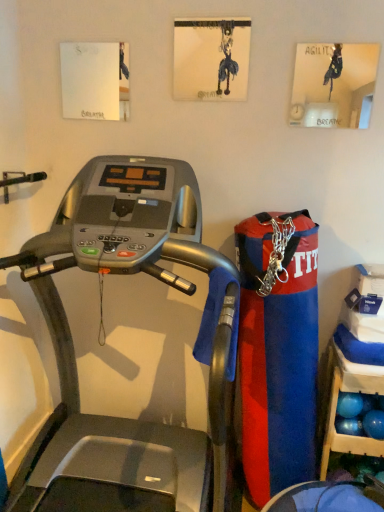
Question: Does silver metallic treadmill at center have a lesser width compared to blue plastic shelf at lower right?

Choices:
 (A) no
 (B) yes

Answer: (A)

Question: Is silver metallic treadmill at center further to the viewer compared to blue plastic shelf at lower right?

Choices:
 (A) no
 (B) yes

Answer: (A)

Question: Is silver metallic treadmill at center aimed at blue plastic shelf at lower right?

Choices:
 (A) yes
 (B) no

Answer: (B)

Question: Considering the relative positions of silver metallic treadmill at center and blue plastic shelf at lower right in the image provided, is silver metallic treadmill at center to the left of blue plastic shelf at lower right from the viewer's perspective?

Choices:
 (A) yes
 (B) no

Answer: (A)

Question: Is silver metallic treadmill at center shorter than blue plastic shelf at lower right?

Choices:
 (A) no
 (B) yes

Answer: (A)

Question: From a real-world perspective, is silver metallic treadmill at center on top of blue plastic shelf at lower right?

Choices:
 (A) yes
 (B) no

Answer: (A)

Question: Does blue plastic shelf at lower right appear on the right side of silver metallic treadmill at center?

Choices:
 (A) yes
 (B) no

Answer: (A)

Question: Can you confirm if blue plastic shelf at lower right is bigger than silver metallic treadmill at center?

Choices:
 (A) yes
 (B) no

Answer: (B)

Question: Considering the relative positions of blue plastic shelf at lower right and silver metallic treadmill at center in the image provided, is blue plastic shelf at lower right behind silver metallic treadmill at center?

Choices:
 (A) yes
 (B) no

Answer: (A)

Question: Is blue plastic shelf at lower right wider than silver metallic treadmill at center?

Choices:
 (A) no
 (B) yes

Answer: (A)

Question: Is blue plastic shelf at lower right completely or partially outside of silver metallic treadmill at center?

Choices:
 (A) yes
 (B) no

Answer: (A)

Question: Could you tell me if blue plastic shelf at lower right is facing silver metallic treadmill at center?

Choices:
 (A) no
 (B) yes

Answer: (A)

Question: In terms of height, does silver metallic treadmill at center look taller or shorter compared to blue plastic shelf at lower right?

Choices:
 (A) short
 (B) tall

Answer: (B)